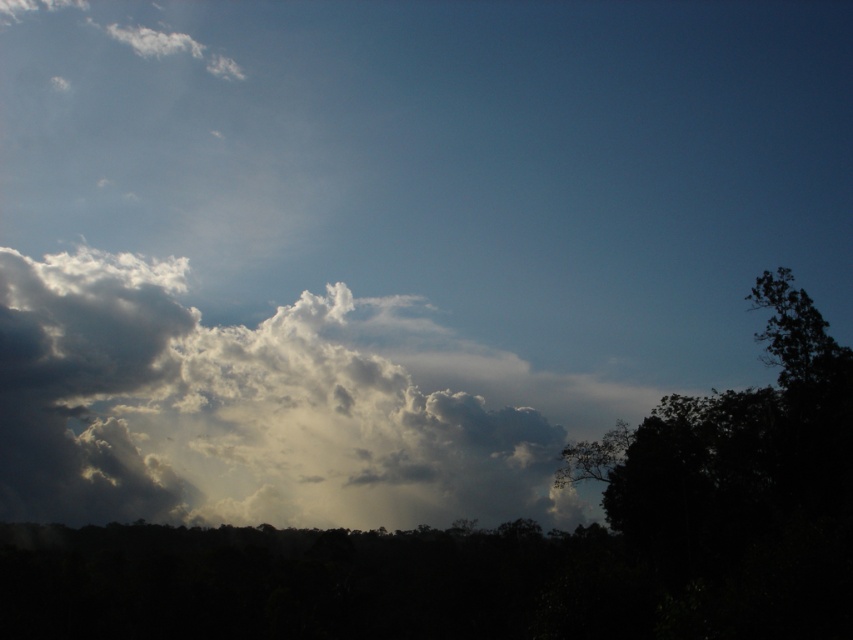
Can you confirm if white fluffy cloud at upper left is positioned above dark green leafy tree at right?

No.

You are a GUI agent. You are given a task and a screenshot of the screen. Output one action in this format:
    pyautogui.click(x=<x>, y=<y>)
    Task: Click on the white fluffy cloud at upper left
    This screenshot has height=640, width=853.
    Given the screenshot: What is the action you would take?
    pyautogui.click(x=265, y=406)